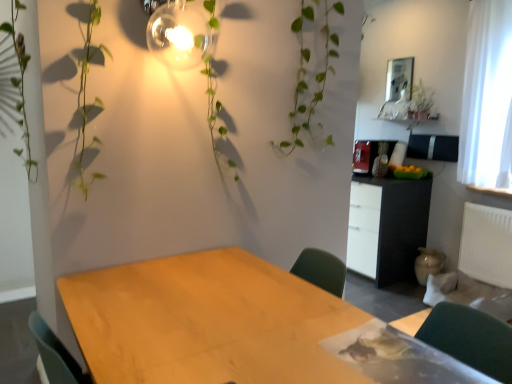
Question: From a real-world perspective, is matte glass light fixture at upper center located higher than wooden table at center?

Choices:
 (A) yes
 (B) no

Answer: (A)

Question: Is matte glass light fixture at upper center wider than wooden table at center?

Choices:
 (A) yes
 (B) no

Answer: (B)

Question: Does matte glass light fixture at upper center have a greater height compared to wooden table at center?

Choices:
 (A) no
 (B) yes

Answer: (A)

Question: Would you consider matte glass light fixture at upper center to be distant from wooden table at center?

Choices:
 (A) yes
 (B) no

Answer: (A)

Question: Is matte glass light fixture at upper center looking in the opposite direction of wooden table at center?

Choices:
 (A) no
 (B) yes

Answer: (A)

Question: Would you say matte glass light fixture at upper center contains wooden table at center?

Choices:
 (A) no
 (B) yes

Answer: (A)

Question: From the image's perspective, is black matte cabinet at center right located beneath white sheer curtain at right?

Choices:
 (A) no
 (B) yes

Answer: (B)

Question: From the image's perspective, is black matte cabinet at center right above white sheer curtain at right?

Choices:
 (A) no
 (B) yes

Answer: (A)

Question: Is black matte cabinet at center right positioned beyond the bounds of white sheer curtain at right?

Choices:
 (A) yes
 (B) no

Answer: (A)

Question: Is black matte cabinet at center right taller than white sheer curtain at right?

Choices:
 (A) no
 (B) yes

Answer: (A)

Question: Is black matte cabinet at center right further to the viewer compared to white sheer curtain at right?

Choices:
 (A) yes
 (B) no

Answer: (A)

Question: Does black matte cabinet at center right have a larger size compared to white sheer curtain at right?

Choices:
 (A) yes
 (B) no

Answer: (A)

Question: From a real-world perspective, is white sheer curtain at right located beneath black matte cabinet at center right?

Choices:
 (A) no
 (B) yes

Answer: (A)